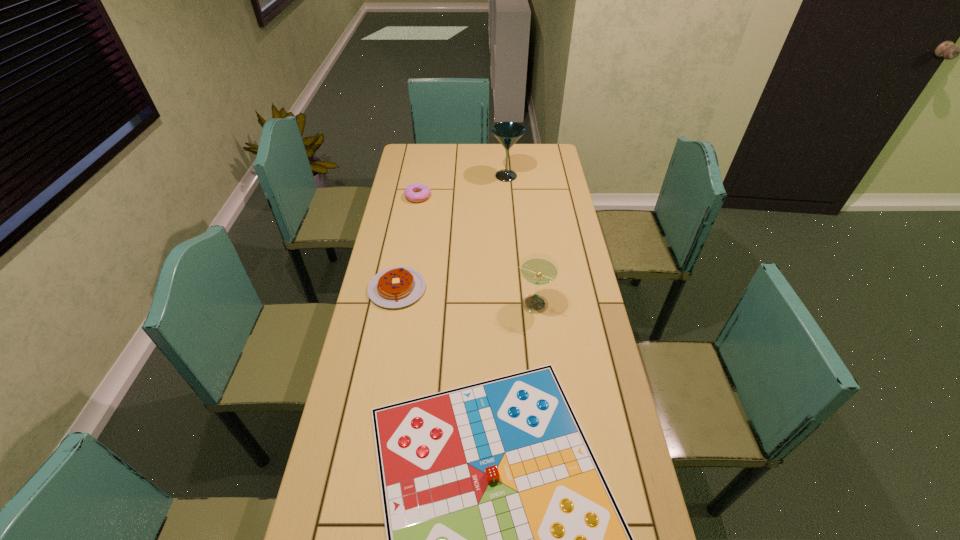
This screenshot has height=540, width=960. In order to click on the farthest object in this screenshot , I will do `click(507, 133)`.

I want to click on the tallest object, so (507, 133).

The height and width of the screenshot is (540, 960). Identify the location of the second tallest object. (539, 269).

The image size is (960, 540). I want to click on the shorter martini, so click(x=539, y=269).

I want to click on doughnut, so click(x=416, y=192).

In order to click on pancake in this screenshot , I will do `click(394, 287)`.

This screenshot has width=960, height=540. What are the coordinates of `free space located on the front of the taller martini` in the screenshot? It's located at (508, 203).

The height and width of the screenshot is (540, 960). In order to click on free space located on the front of the shorter martini in this screenshot , I will do `click(543, 407)`.

Where is `free spot located 0.300m on the right of the second farthest object`? Image resolution: width=960 pixels, height=540 pixels. free spot located 0.300m on the right of the second farthest object is located at coordinates (499, 197).

Where is `free region located on the right of the pancake`? The height and width of the screenshot is (540, 960). free region located on the right of the pancake is located at coordinates (441, 288).